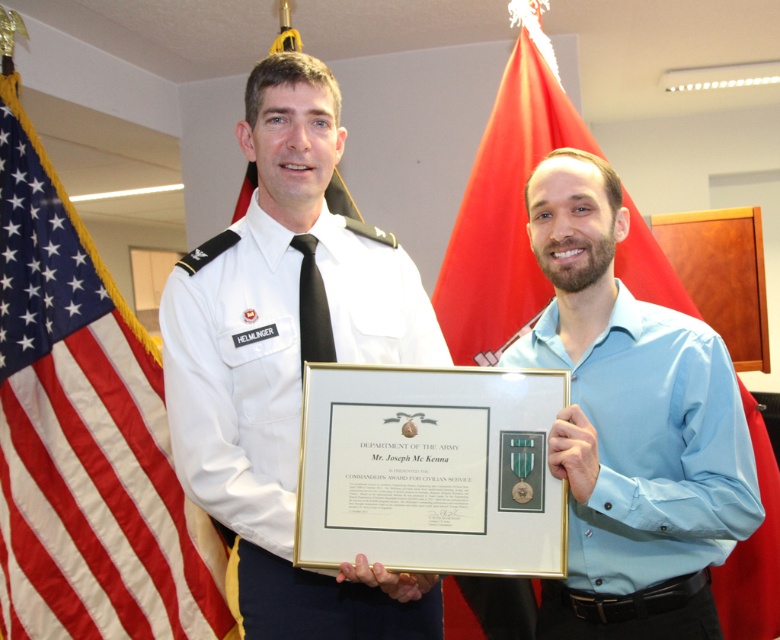
Is point (683, 352) more distant than point (445, 595)?

No, it is in front of (445, 595).

Does point (667, 416) lie in front of point (523, 618)?

Yes, point (667, 416) is closer to viewer.

This screenshot has height=640, width=780. I want to click on light blue cotton shirt at center, so [663, 460].

Between white uniform at center and light blue cotton shirt at center, which one has less height?

light blue cotton shirt at center is shorter.

Is point (275, 365) positioned before point (636, 301)?

Yes.

Locate an element on the screen. This screenshot has width=780, height=640. white uniform at center is located at coordinates (236, 376).

Is red-white striped flag at left taller than red fabric flag at upper center?

Indeed, red-white striped flag at left has a greater height compared to red fabric flag at upper center.

Which is more to the left, red-white striped flag at left or red fabric flag at upper center?

From the viewer's perspective, red-white striped flag at left appears more on the left side.

Is point (41, 364) in front of point (529, 44)?

No, (41, 364) is further to viewer.

Where is `red-white striped flag at left`? red-white striped flag at left is located at coordinates (84, 435).